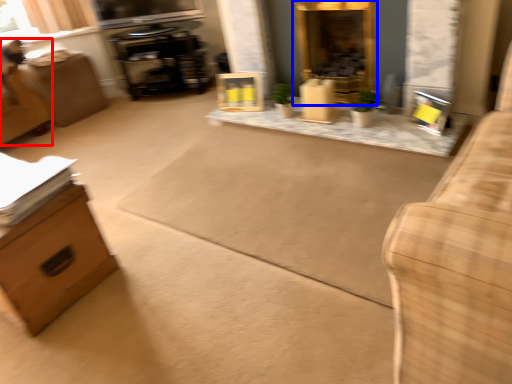
Question: Which point is further to the camera, swivel chair (highlighted by a red box) or fireplace (highlighted by a blue box)?

Choices:
 (A) swivel chair
 (B) fireplace

Answer: (A)